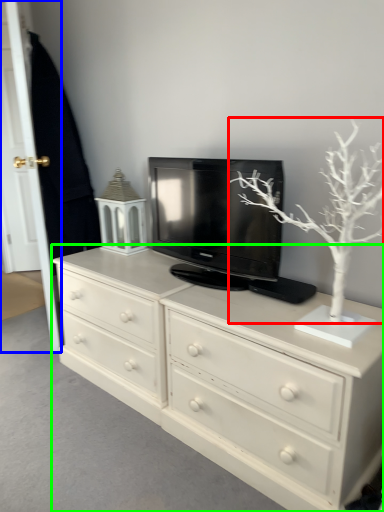
Question: Which object is the farthest from tree (highlighted by a red box)? Choose among these: door (highlighted by a blue box) or chest of drawers (highlighted by a green box).

Choices:
 (A) door
 (B) chest of drawers

Answer: (A)